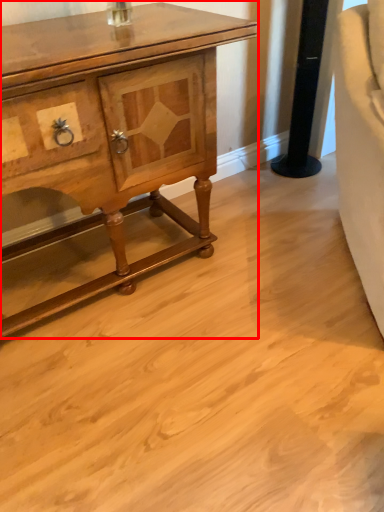
Question: From the image's perspective, what is the correct spatial positioning of chest of drawers (annotated by the red box) in reference to pillar?

Choices:
 (A) below
 (B) above

Answer: (A)